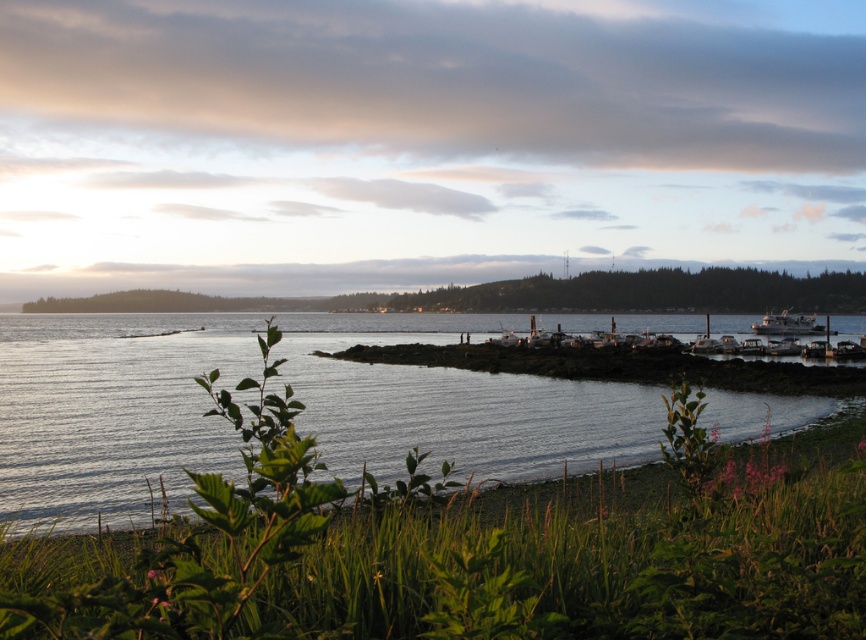
Question: Which point is closer to the camera?

Choices:
 (A) (792, 323)
 (B) (527, 397)

Answer: (B)

Question: Which object appears farthest from the camera in this image?

Choices:
 (A) clear water at lower center
 (B) white matte boat at right

Answer: (B)

Question: Is clear water at lower center above white matte boat at right?

Choices:
 (A) no
 (B) yes

Answer: (B)

Question: Is clear water at lower center in front of white matte boat at right?

Choices:
 (A) no
 (B) yes

Answer: (B)

Question: Which object is farther from the camera taking this photo?

Choices:
 (A) clear water at lower center
 (B) white matte boat at right

Answer: (B)

Question: Does clear water at lower center have a lesser width compared to white matte boat at right?

Choices:
 (A) no
 (B) yes

Answer: (A)